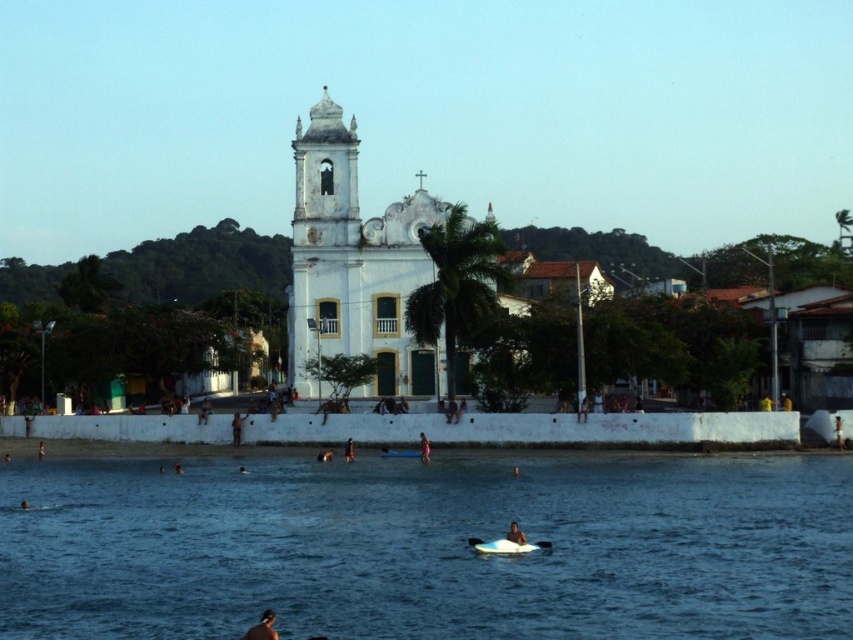
Does blue water at center have a larger size compared to dark blue fabric surfboard at center?

Indeed, blue water at center has a larger size compared to dark blue fabric surfboard at center.

Based on the photo, which is more to the left, blue water at center or dark blue fabric surfboard at center?

From the viewer's perspective, dark blue fabric surfboard at center appears more on the left side.

Which is in front, point (711, 602) or point (350, 461)?

Positioned in front is point (711, 602).

The image size is (853, 640). Identify the location of blue water at center. coord(428,548).

Is blue water at center taller than smooth skin person at lower left?

Indeed, blue water at center has a greater height compared to smooth skin person at lower left.

Does blue water at center come behind smooth skin person at lower left?

No, blue water at center is in front of smooth skin person at lower left.

I want to click on blue water at center, so click(x=428, y=548).

You are a GUI agent. You are given a task and a screenshot of the screen. Output one action in this format:
    pyautogui.click(x=<x>, y=<y>)
    Task: Click on the blue water at center
    Image resolution: width=853 pixels, height=640 pixels.
    Given the screenshot: What is the action you would take?
    pyautogui.click(x=428, y=548)

Is white foam surfboard at lower center closer to the viewer compared to smooth skin person at center?

That is True.

Is point (508, 541) positioned behind point (233, 438)?

No, it is not.

In order to click on white foam surfboard at lower center in this screenshot , I will do `click(506, 545)`.

In order to click on white foam surfboard at lower center in this screenshot , I will do `click(506, 545)`.